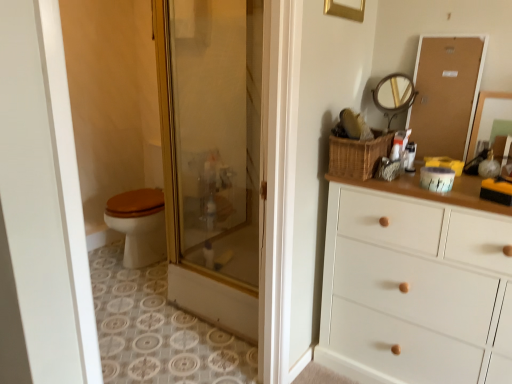
Question: Is corkboard at upper right positioned with its back to woven brown basket at upper right?

Choices:
 (A) no
 (B) yes

Answer: (A)

Question: Is corkboard at upper right to the right of woven brown basket at upper right from the viewer's perspective?

Choices:
 (A) no
 (B) yes

Answer: (B)

Question: Can you confirm if corkboard at upper right is shorter than woven brown basket at upper right?

Choices:
 (A) no
 (B) yes

Answer: (A)

Question: Is woven brown basket at upper right located within corkboard at upper right?

Choices:
 (A) no
 (B) yes

Answer: (A)

Question: Considering the relative sizes of corkboard at upper right and woven brown basket at upper right in the image provided, is corkboard at upper right thinner than woven brown basket at upper right?

Choices:
 (A) no
 (B) yes

Answer: (B)

Question: Relative to gold-toned metal mirror at upper right, which ranks as the first mirror in left-to-right order, is matte wooden mirror at upper right, which is the second mirror from left to right, in front or behind?

Choices:
 (A) behind
 (B) front

Answer: (B)

Question: Is matte wooden mirror at upper right, which is the second mirror from left to right, bigger or smaller than gold-toned metal mirror at upper right, which ranks as the first mirror in left-to-right order?

Choices:
 (A) big
 (B) small

Answer: (A)

Question: From a real-world perspective, is matte wooden mirror at upper right, which is the second mirror from left to right, physically located above or below gold-toned metal mirror at upper right, which ranks as the 2th mirror in right-to-left order?

Choices:
 (A) below
 (B) above

Answer: (A)

Question: From the image's perspective, relative to gold-toned metal mirror at upper right, which ranks as the 2th mirror in right-to-left order, is matte wooden mirror at upper right, which is the second mirror from left to right, above or below?

Choices:
 (A) below
 (B) above

Answer: (A)

Question: Is white painted wood chest of drawers at right in front of or behind matte wooden mirror at upper right, which is the second mirror from left to right, in the image?

Choices:
 (A) behind
 (B) front

Answer: (B)

Question: From a real-world perspective, is white painted wood chest of drawers at right physically located above or below matte wooden mirror at upper right, positioned as the first mirror in right-to-left order?

Choices:
 (A) above
 (B) below

Answer: (B)

Question: Looking at their shapes, would you say white painted wood chest of drawers at right is wider or thinner than matte wooden mirror at upper right, positioned as the first mirror in right-to-left order?

Choices:
 (A) thin
 (B) wide

Answer: (B)

Question: In terms of height, does white painted wood chest of drawers at right look taller or shorter compared to matte wooden mirror at upper right, which is the second mirror from left to right?

Choices:
 (A) short
 (B) tall

Answer: (B)

Question: Is woven brown basket at upper right taller or shorter than corkboard at upper right?

Choices:
 (A) tall
 (B) short

Answer: (B)

Question: From a real-world perspective, is woven brown basket at upper right above or below corkboard at upper right?

Choices:
 (A) above
 (B) below

Answer: (B)